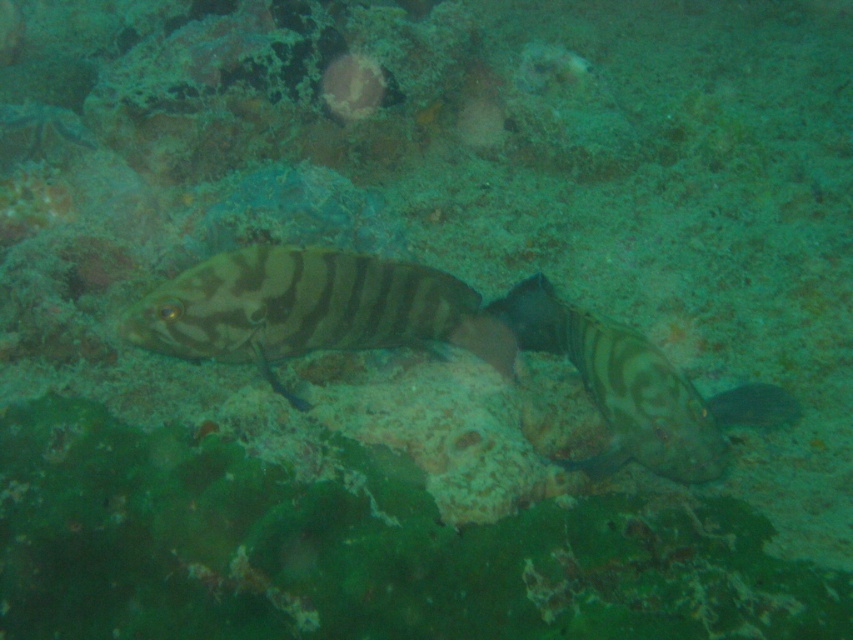
Question: Which object appears closest to the camera in this image?

Choices:
 (A) striped matte fish at center
 (B) brown striped fish at center

Answer: (B)

Question: Does striped matte fish at center come behind brown striped fish at center?

Choices:
 (A) yes
 (B) no

Answer: (A)

Question: Which point is farther from the camera taking this photo?

Choices:
 (A) (599, 353)
 (B) (346, 308)

Answer: (A)

Question: Can you confirm if striped matte fish at center is bigger than brown striped fish at center?

Choices:
 (A) yes
 (B) no

Answer: (B)

Question: Considering the relative positions of striped matte fish at center and brown striped fish at center in the image provided, where is striped matte fish at center located with respect to brown striped fish at center?

Choices:
 (A) above
 (B) below

Answer: (A)